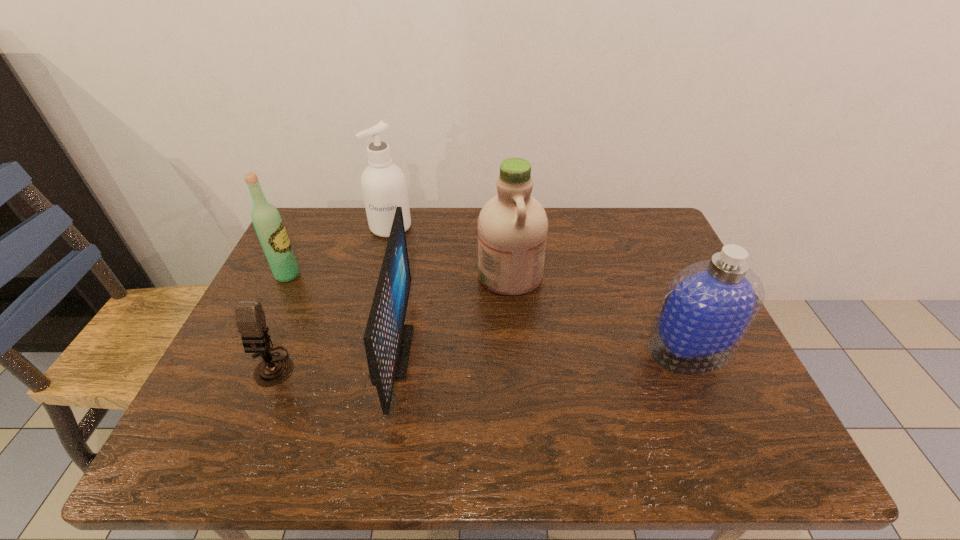
In order to click on vacant space located 0.300m on the front label of the second cleansing agent from right to left in this screenshot , I will do `click(371, 275)`.

At what (x,y) coordinates should I click in order to perform the action: click on free space located on the front label of the second cleansing agent from right to left. Please return your answer as a coordinate pair (x, y). Looking at the image, I should click on (428, 275).

This screenshot has width=960, height=540. I want to click on vacant space located on the front label of the leftmost cleansing agent, so click(383, 258).

Locate an element on the screen. vacant area situated 0.240m on the front-facing side of the wine bottle is located at coordinates (386, 275).

The height and width of the screenshot is (540, 960). I want to click on vacant region located on the back of the nearest cleansing agent, so click(648, 259).

This screenshot has width=960, height=540. Find the location of `vacant area located 0.390m on the screen side of the computer monitor`. vacant area located 0.390m on the screen side of the computer monitor is located at coordinates (577, 352).

You are a GUI agent. You are given a task and a screenshot of the screen. Output one action in this format:
    pyautogui.click(x=<x>, y=<y>)
    Task: Click on the free location located 0.110m on the front-facing side of the shortest object
    Image resolution: width=960 pixels, height=540 pixels.
    Given the screenshot: What is the action you would take?
    pyautogui.click(x=242, y=434)

Locate an element on the screen. The image size is (960, 540). object that is at the far edge is located at coordinates (383, 184).

Where is `object at the near edge`? The width and height of the screenshot is (960, 540). object at the near edge is located at coordinates (387, 340).

Identify the location of wine bottle located in the left edge section of the desktop. The width and height of the screenshot is (960, 540). (268, 224).